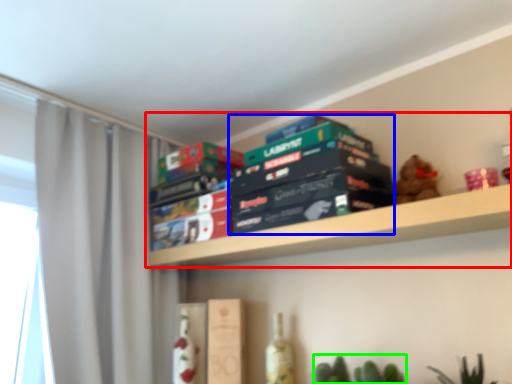
Question: Which object is positioned closest to shelf (highlighted by a red box)? Select from book (highlighted by a blue box) and plant (highlighted by a green box).

Choices:
 (A) book
 (B) plant

Answer: (A)